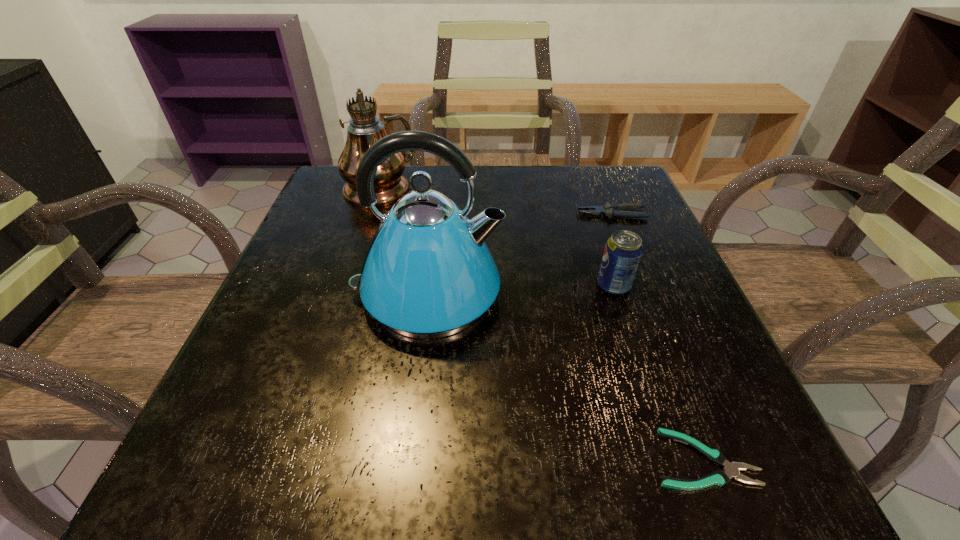
Find the location of `the tallest object`. the tallest object is located at coordinates (356, 81).

Where is `kettle`? This screenshot has width=960, height=540. kettle is located at coordinates (428, 273).

Identify the location of the third tallest object. (623, 250).

Find the location of `the fourth tallest object`. the fourth tallest object is located at coordinates (610, 210).

Identify the location of the farther pliers. (610, 210).

Find the location of `the nearest object`. the nearest object is located at coordinates [x=731, y=470].

In order to click on the nearer pliers in this screenshot , I will do `click(731, 470)`.

At what (x,y) coordinates should I click in order to perform the action: click on vacant space situated 0.270m on the front of the oil lamp. Please return your answer as a coordinate pair (x, y). Looking at the image, I should click on (347, 291).

This screenshot has height=540, width=960. Identify the location of vacant space located 0.150m at the spout of the kettle. (587, 295).

Where is `vacant region located on the front of the soda`? vacant region located on the front of the soda is located at coordinates (626, 323).